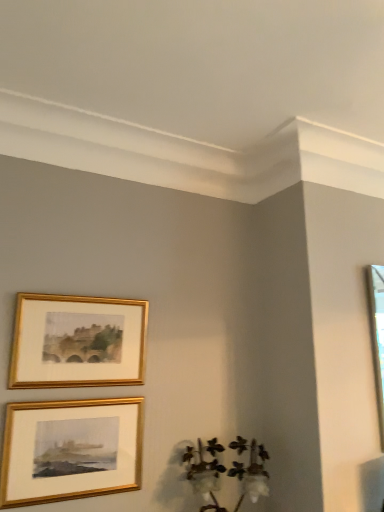
Question: Considering the relative sizes of gold/gilded picture frame at upper left, which is counted as the second picture frame, starting from the bottom, and gold/glossy picture frame at lower left, which appears as the second picture frame when viewed from the top, in the image provided, is gold/gilded picture frame at upper left, which is counted as the second picture frame, starting from the bottom, shorter than gold/glossy picture frame at lower left, which appears as the second picture frame when viewed from the top,?

Choices:
 (A) yes
 (B) no

Answer: (A)

Question: Does gold/gilded picture frame at upper left, which is counted as the second picture frame, starting from the bottom, lie behind gold/glossy picture frame at lower left, which appears as the second picture frame when viewed from the top?

Choices:
 (A) yes
 (B) no

Answer: (A)

Question: Is gold/gilded picture frame at upper left, which is counted as the second picture frame, starting from the bottom, completely or partially outside of gold/glossy picture frame at lower left, positioned as the 1th picture frame in bottom-to-top order?

Choices:
 (A) no
 (B) yes

Answer: (B)

Question: From a real-world perspective, is gold/gilded picture frame at upper left, which is counted as the second picture frame, starting from the bottom, physically below gold/glossy picture frame at lower left, which appears as the second picture frame when viewed from the top?

Choices:
 (A) yes
 (B) no

Answer: (B)

Question: Is gold/gilded picture frame at upper left, which is counted as the second picture frame, starting from the bottom, facing away from gold/glossy picture frame at lower left, which appears as the second picture frame when viewed from the top?

Choices:
 (A) yes
 (B) no

Answer: (B)

Question: Visually, is gold/gilded picture frame at upper left, placed as the 1th picture frame when sorted from top to bottom, positioned to the left or to the right of white cotton at lower right?

Choices:
 (A) left
 (B) right

Answer: (A)

Question: Considering the positions of gold/gilded picture frame at upper left, which is counted as the second picture frame, starting from the bottom, and white cotton at lower right in the image, is gold/gilded picture frame at upper left, which is counted as the second picture frame, starting from the bottom, wider or thinner than white cotton at lower right?

Choices:
 (A) thin
 (B) wide

Answer: (A)

Question: Considering the positions of gold/gilded picture frame at upper left, which is counted as the second picture frame, starting from the bottom, and white cotton at lower right in the image, is gold/gilded picture frame at upper left, which is counted as the second picture frame, starting from the bottom, bigger or smaller than white cotton at lower right?

Choices:
 (A) big
 (B) small

Answer: (B)

Question: Is gold/gilded picture frame at upper left, which is counted as the second picture frame, starting from the bottom, spatially inside white cotton at lower right, or outside of it?

Choices:
 (A) outside
 (B) inside

Answer: (A)

Question: From a real-world perspective, is gold/glossy picture frame at lower left, positioned as the 1th picture frame in bottom-to-top order, above or below gold/gilded picture frame at upper left, which is counted as the second picture frame, starting from the bottom?

Choices:
 (A) below
 (B) above

Answer: (A)

Question: Is gold/glossy picture frame at lower left, positioned as the 1th picture frame in bottom-to-top order, bigger or smaller than gold/gilded picture frame at upper left, which is counted as the second picture frame, starting from the bottom?

Choices:
 (A) small
 (B) big

Answer: (A)

Question: Choose the correct answer: Is gold/glossy picture frame at lower left, positioned as the 1th picture frame in bottom-to-top order, inside gold/gilded picture frame at upper left, which is counted as the second picture frame, starting from the bottom, or outside it?

Choices:
 (A) outside
 (B) inside

Answer: (A)

Question: In terms of width, does gold/glossy picture frame at lower left, which appears as the second picture frame when viewed from the top, look wider or thinner when compared to gold/gilded picture frame at upper left, placed as the 1th picture frame when sorted from top to bottom?

Choices:
 (A) wide
 (B) thin

Answer: (B)

Question: Relative to gold/glossy picture frame at lower left, positioned as the 1th picture frame in bottom-to-top order, is gold/gilded picture frame at upper left, which is counted as the second picture frame, starting from the bottom, in front or behind?

Choices:
 (A) front
 (B) behind

Answer: (B)

Question: In terms of width, does gold/gilded picture frame at upper left, which is counted as the second picture frame, starting from the bottom, look wider or thinner when compared to gold/glossy picture frame at lower left, positioned as the 1th picture frame in bottom-to-top order?

Choices:
 (A) thin
 (B) wide

Answer: (B)